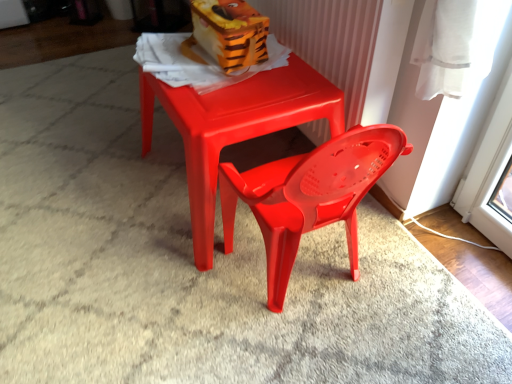
Question: From a real-world perspective, relative to orange plastic toy at upper center, is matte plastic table at center vertically above or below?

Choices:
 (A) below
 (B) above

Answer: (A)

Question: Considering their positions, is matte plastic table at center located in front of or behind orange plastic toy at upper center?

Choices:
 (A) front
 (B) behind

Answer: (A)

Question: From the image's perspective, is matte plastic table at center above or below orange plastic toy at upper center?

Choices:
 (A) above
 (B) below

Answer: (B)

Question: Looking at the image, does orange plastic toy at upper center seem bigger or smaller compared to matte plastic table at center?

Choices:
 (A) small
 (B) big

Answer: (A)

Question: From the image's perspective, is orange plastic toy at upper center above or below matte plastic table at center?

Choices:
 (A) below
 (B) above

Answer: (B)

Question: From a real-world perspective, is orange plastic toy at upper center above or below matte plastic table at center?

Choices:
 (A) below
 (B) above

Answer: (B)

Question: Would you say orange plastic toy at upper center is inside or outside matte plastic table at center?

Choices:
 (A) outside
 (B) inside

Answer: (A)